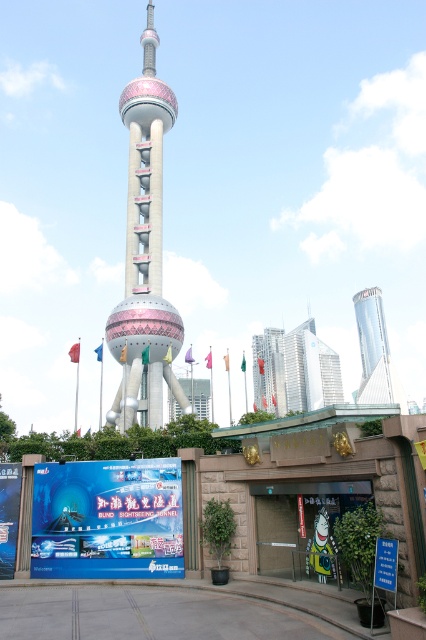
Between polished concrete tower at center and silver metallic skyscraper at center, which one has less height?

Standing shorter between the two is silver metallic skyscraper at center.

Can you confirm if polished concrete tower at center is bigger than silver metallic skyscraper at center?

No.

Between point (160, 388) and point (362, 368), which one is positioned behind?

Positioned behind is point (362, 368).

In order to click on polished concrete tower at center in this screenshot , I will do `click(144, 252)`.

Does polished concrete tower at center have a greater height compared to glassy reflective skyscraper at center?

Yes, polished concrete tower at center is taller than glassy reflective skyscraper at center.

Is polished concrete tower at center above glassy reflective skyscraper at center?

Yes, polished concrete tower at center is above glassy reflective skyscraper at center.

Who is more forward, (152, 401) or (281, 378)?

Point (152, 401) is more forward.

Image resolution: width=426 pixels, height=640 pixels. What are the coordinates of `polished concrete tower at center` in the screenshot? It's located at (144, 252).

Between silver metallic skyscraper at center and blue glossy billboard at center, which one is positioned higher?

Positioned higher is blue glossy billboard at center.

Does silver metallic skyscraper at center appear on the right side of blue glossy billboard at center?

Correct, you'll find silver metallic skyscraper at center to the right of blue glossy billboard at center.

Is point (371, 371) less distant than point (8, 540)?

No, it is behind (8, 540).

This screenshot has height=640, width=426. In order to click on silver metallic skyscraper at center in this screenshot , I will do `click(374, 348)`.